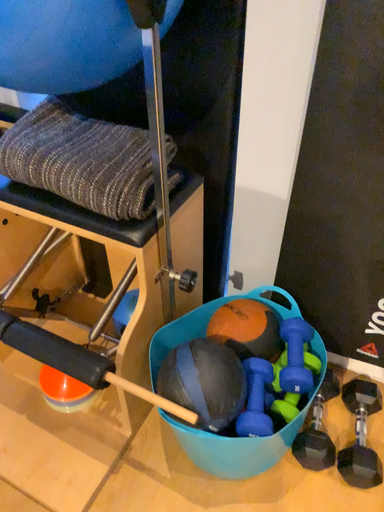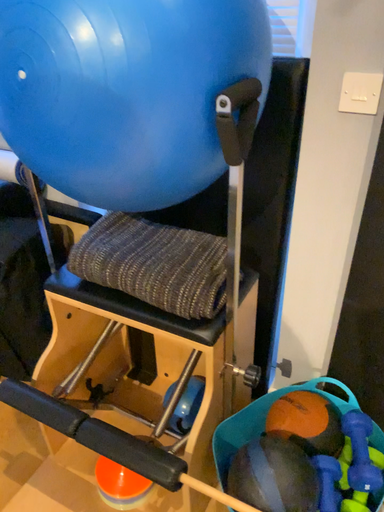
Question: Which way did the camera rotate in the video?

Choices:
 (A) rotated downward
 (B) rotated upward

Answer: (B)